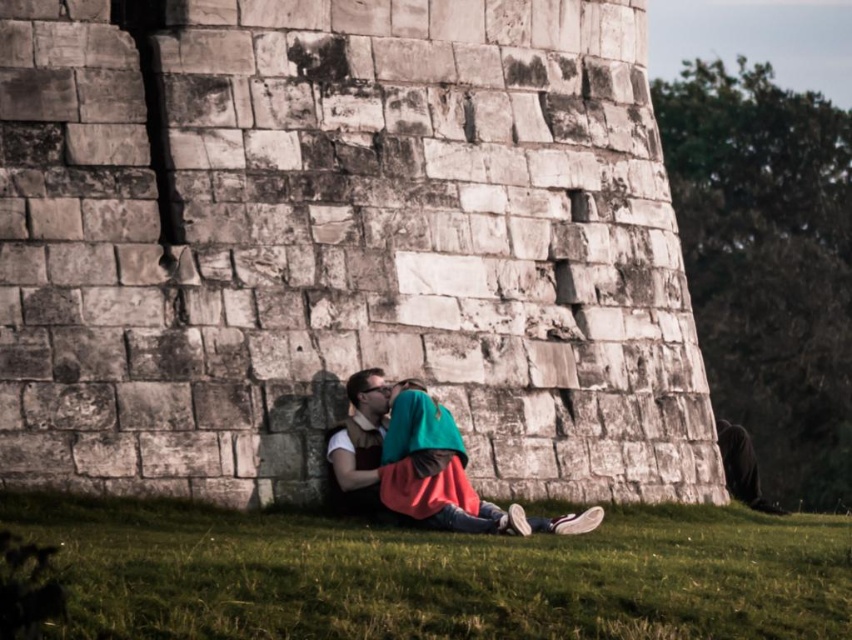
You are a photographer planning to take a portrait of the two people sitting in front of the ancient stone wall. You want to ensure that the green grass at lower center and the matte brown vest at center are both visible in the frame. Based on their sizes, which object should you focus on to ensure both are in focus?

Since the green grass at lower center is wider than the matte brown vest at center, you should focus on the green grass at lower center to ensure both are in focus as it occupies more space in the frame.

You are standing in front of an ancient stone wall and see the green grass at lower center and the matte brown vest at center. Which object is closer to you?

The green grass at lower center is closer to the viewer than the matte brown vest at center.

You are a drone operator trying to capture a photo of the two people sitting near the ancient stone wall. Your drone must maintain a minimum altitude of 30 feet to avoid detection. If the green grass at lower center is where the drone is currently hovering and the teal fabric scarf at center is the target, can the drone safely descend to take the photo without violating the altitude restriction?

The distance between the green grass at lower center and the teal fabric scarf at center is 31.64 feet. Since the drone must stay above 30 feet, it can safely descend to 30.64 feet to capture the photo without violating the altitude restriction.